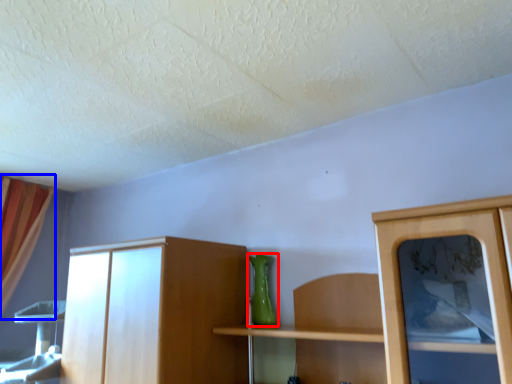
Question: Which of the following is the farthest to the observer, vase (highlighted by a red box) or curtain (highlighted by a blue box)?

Choices:
 (A) vase
 (B) curtain

Answer: (B)